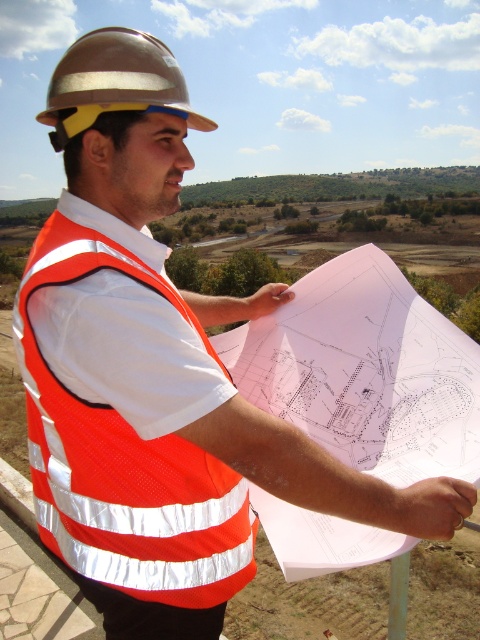
Does reflective orange safety vest at center appear over metallic hard hat at upper left?

Incorrect, reflective orange safety vest at center is not positioned above metallic hard hat at upper left.

Where is `reflective orange safety vest at center`? This screenshot has width=480, height=640. reflective orange safety vest at center is located at coordinates (124, 460).

Locate an element on the screen. The width and height of the screenshot is (480, 640). reflective orange safety vest at center is located at coordinates (124, 460).

The image size is (480, 640). I want to click on reflective orange safety vest at center, so click(124, 460).